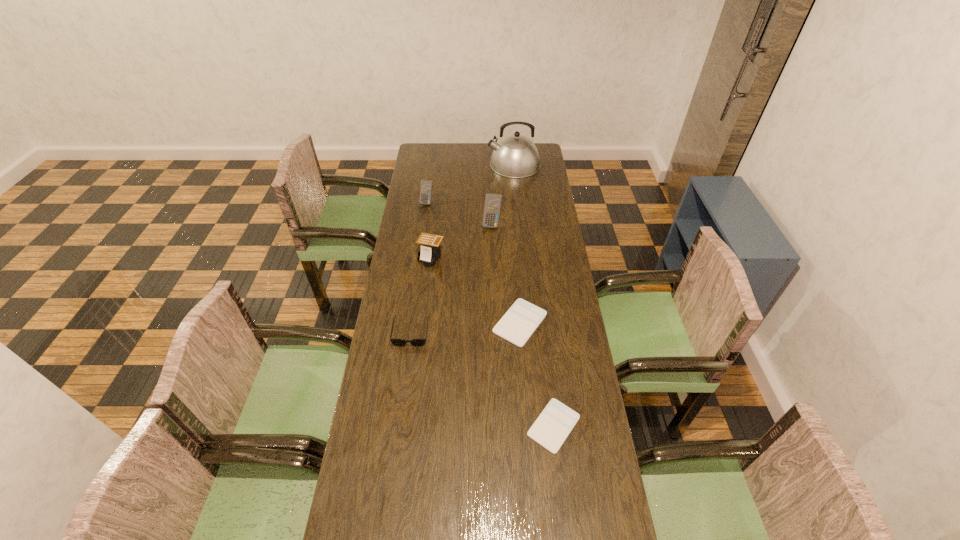
What are the coordinates of `the tallest object` in the screenshot? It's located at (516, 156).

Where is `the farthest object`? Image resolution: width=960 pixels, height=540 pixels. the farthest object is located at coordinates (516, 156).

Find the location of a particular element. Image resolution: width=960 pixels, height=540 pixels. the tallest calculator is located at coordinates (492, 205).

Identify the location of the bigger blue calculator. (492, 205).

The image size is (960, 540). Identify the location of the farther blue calculator. (426, 186).

Locate an element on the screen. The image size is (960, 540). the fifth shortest object is located at coordinates (426, 186).

Find the location of a particular element. This screenshot has width=960, height=540. the third shortest calculator is located at coordinates (430, 251).

The image size is (960, 540). I want to click on the fourth nearest object, so click(x=430, y=251).

You are a GUI agent. You are given a task and a screenshot of the screen. Output one action in this format:
    pyautogui.click(x=<x>, y=<y>)
    Task: Click on the sunglasses
    The height and width of the screenshot is (540, 960).
    Given the screenshot: What is the action you would take?
    pyautogui.click(x=420, y=342)

Identify the location of the third shortest object. (420, 342).